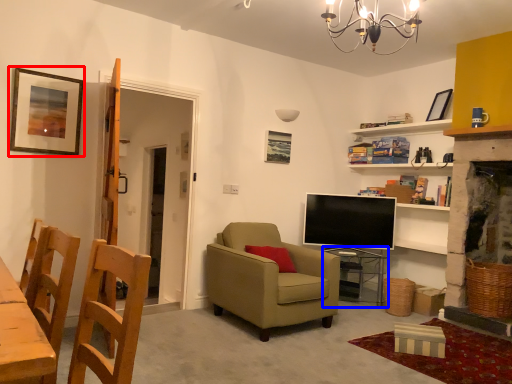
Question: Among these objects, which one is nearest to the camera, picture frame (highlighted by a red box) or table (highlighted by a blue box)?

Choices:
 (A) picture frame
 (B) table

Answer: (A)